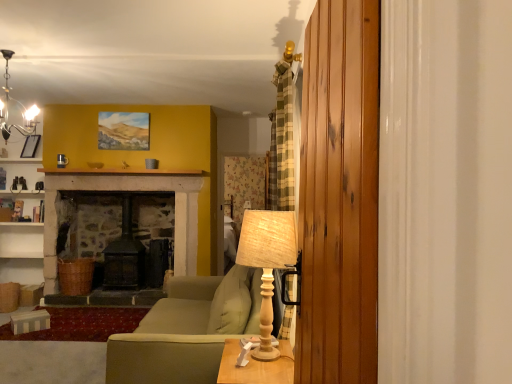
Question: From the image's perspective, is matte black chandelier at upper left over wooden table at lower center?

Choices:
 (A) no
 (B) yes

Answer: (B)

Question: Does matte black chandelier at upper left come in front of wooden table at lower center?

Choices:
 (A) no
 (B) yes

Answer: (A)

Question: Considering the relative sizes of matte black chandelier at upper left and wooden table at lower center in the image provided, is matte black chandelier at upper left taller than wooden table at lower center?

Choices:
 (A) yes
 (B) no

Answer: (A)

Question: Considering the relative sizes of matte black chandelier at upper left and wooden table at lower center in the image provided, is matte black chandelier at upper left shorter than wooden table at lower center?

Choices:
 (A) no
 (B) yes

Answer: (A)

Question: Is matte black chandelier at upper left behind wooden table at lower center?

Choices:
 (A) no
 (B) yes

Answer: (B)

Question: In terms of size, does wooden table lamp at center appear bigger or smaller than wooden barn door at right?

Choices:
 (A) small
 (B) big

Answer: (A)

Question: In the image, is wooden table lamp at center positioned in front of or behind wooden barn door at right?

Choices:
 (A) front
 (B) behind

Answer: (B)

Question: From their relative heights in the image, would you say wooden table lamp at center is taller or shorter than wooden barn door at right?

Choices:
 (A) tall
 (B) short

Answer: (B)

Question: From a real-world perspective, is wooden table lamp at center above or below wooden barn door at right?

Choices:
 (A) above
 (B) below

Answer: (B)

Question: In the image, is wooden table lamp at center on the left side or the right side of wooden table at lower center?

Choices:
 (A) left
 (B) right

Answer: (B)

Question: Considering the positions of point (267, 327) and point (272, 374), is point (267, 327) closer or farther from the camera than point (272, 374)?

Choices:
 (A) farther
 (B) closer

Answer: (A)

Question: From the image's perspective, relative to wooden table at lower center, is wooden table lamp at center above or below?

Choices:
 (A) below
 (B) above

Answer: (B)

Question: From a real-world perspective, is wooden table lamp at center physically located above or below wooden table at lower center?

Choices:
 (A) below
 (B) above

Answer: (B)

Question: From a real-world perspective, relative to wooden barn door at right, is green fabric couch at center vertically above or below?

Choices:
 (A) below
 (B) above

Answer: (A)

Question: Is green fabric couch at center in front of or behind wooden barn door at right in the image?

Choices:
 (A) front
 (B) behind

Answer: (B)